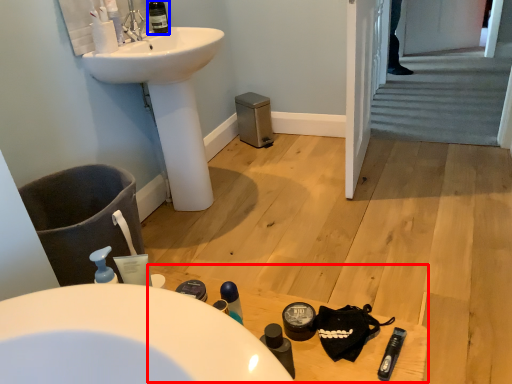
Question: Which point is closer to the camera, table (highlighted by a red box) or wine bottle (highlighted by a blue box)?

Choices:
 (A) table
 (B) wine bottle

Answer: (A)